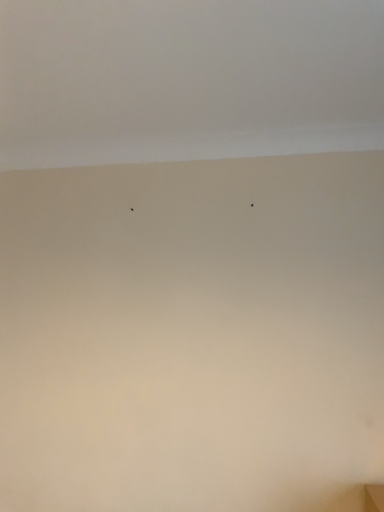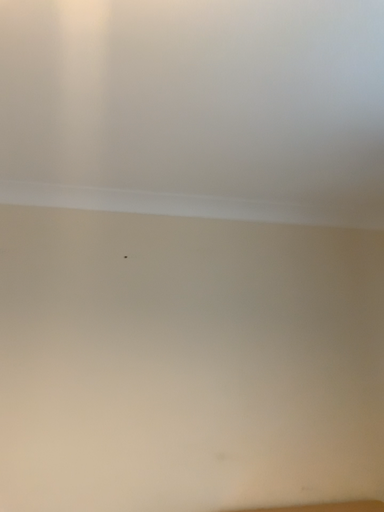
Question: Which way did the camera rotate in the video?

Choices:
 (A) rotated left
 (B) rotated right

Answer: (B)